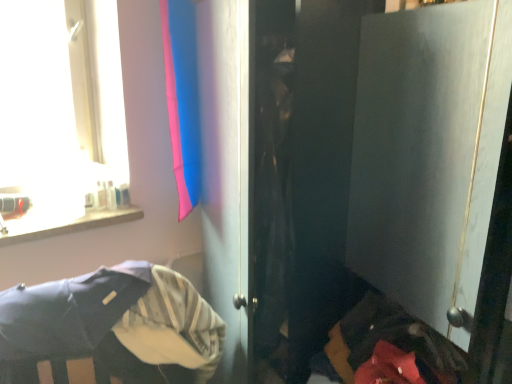
This screenshot has width=512, height=384. Describe the element at coordinates (436, 168) in the screenshot. I see `matte gray door at center right` at that location.

The width and height of the screenshot is (512, 384). What are the coordinates of `matte gray door at center right` in the screenshot? It's located at [436, 168].

The width and height of the screenshot is (512, 384). Find the location of `matte gray door at center right`. matte gray door at center right is located at coordinates (436, 168).